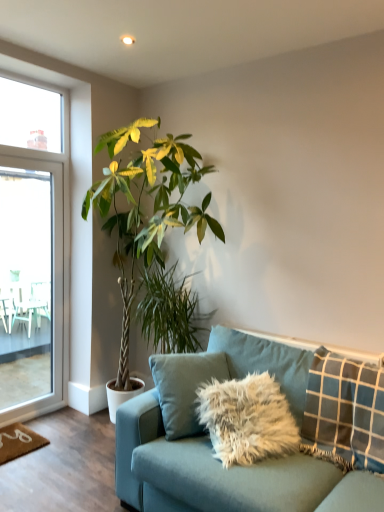
Question: Is blue checkered pillow at right to the left of transparent glass screen door at left from the viewer's perspective?

Choices:
 (A) yes
 (B) no

Answer: (B)

Question: From a real-world perspective, is blue checkered pillow at right beneath transparent glass screen door at left?

Choices:
 (A) yes
 (B) no

Answer: (A)

Question: From the image's perspective, is blue checkered pillow at right located above transparent glass screen door at left?

Choices:
 (A) yes
 (B) no

Answer: (B)

Question: Can you confirm if blue checkered pillow at right is smaller than transparent glass screen door at left?

Choices:
 (A) no
 (B) yes

Answer: (A)

Question: Does blue checkered pillow at right lie in front of transparent glass screen door at left?

Choices:
 (A) no
 (B) yes

Answer: (B)

Question: Can you confirm if blue checkered pillow at right is bigger than transparent glass screen door at left?

Choices:
 (A) yes
 (B) no

Answer: (A)

Question: Is the depth of transparent glass screen door at left less than that of teal fabric couch at lower right?

Choices:
 (A) no
 (B) yes

Answer: (A)

Question: Is transparent glass screen door at left bigger than teal fabric couch at lower right?

Choices:
 (A) no
 (B) yes

Answer: (A)

Question: Can you confirm if transparent glass screen door at left is smaller than teal fabric couch at lower right?

Choices:
 (A) no
 (B) yes

Answer: (B)

Question: From a real-world perspective, is transparent glass screen door at left located beneath teal fabric couch at lower right?

Choices:
 (A) yes
 (B) no

Answer: (B)

Question: Is transparent glass screen door at left at the left side of teal fabric couch at lower right?

Choices:
 (A) no
 (B) yes

Answer: (B)

Question: From a real-world perspective, is transparent glass screen door at left physically above teal fabric couch at lower right?

Choices:
 (A) yes
 (B) no

Answer: (A)

Question: Is teal fabric couch at lower right thinner than blue checkered pillow at right?

Choices:
 (A) yes
 (B) no

Answer: (B)